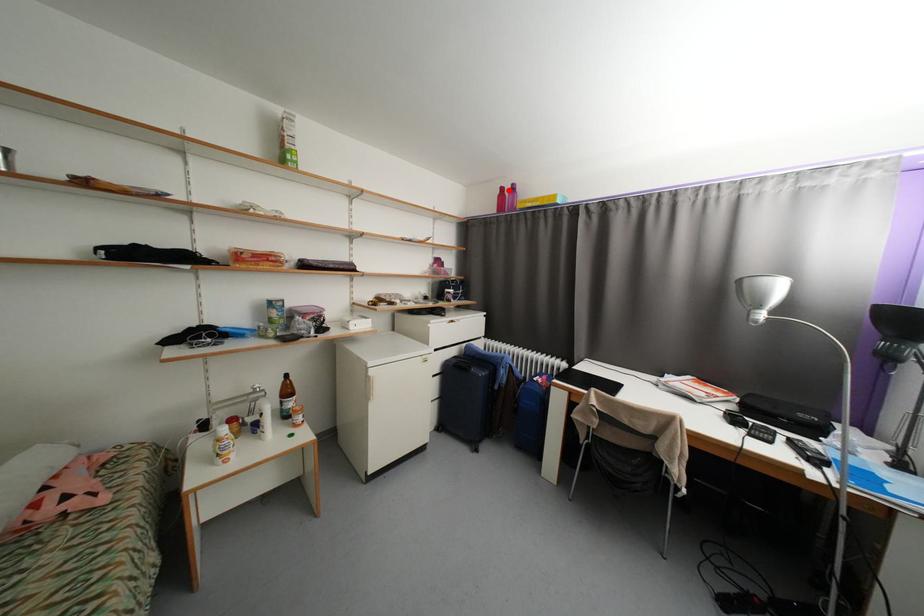
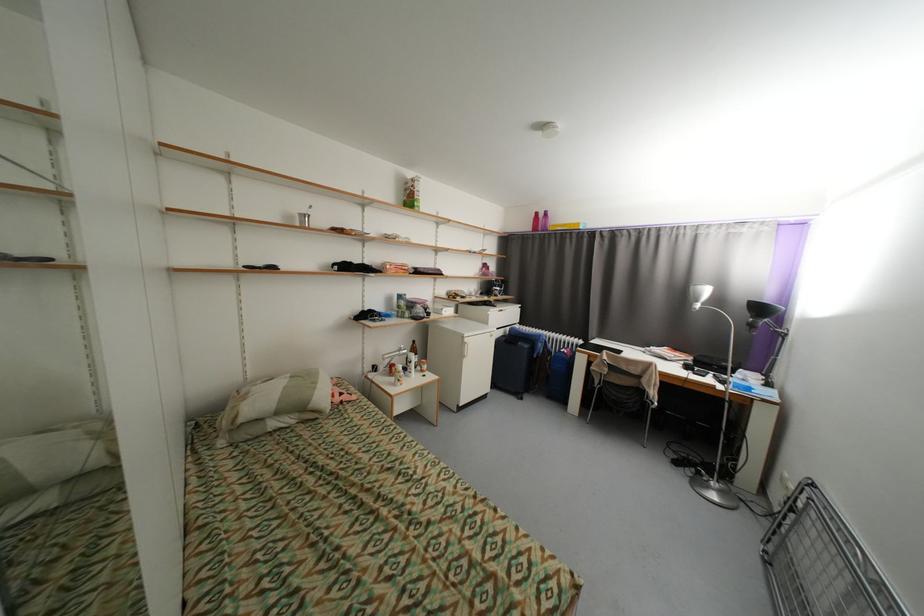
Find the pixel in the second image that matches the highlighted location in the first image.

(542, 215)